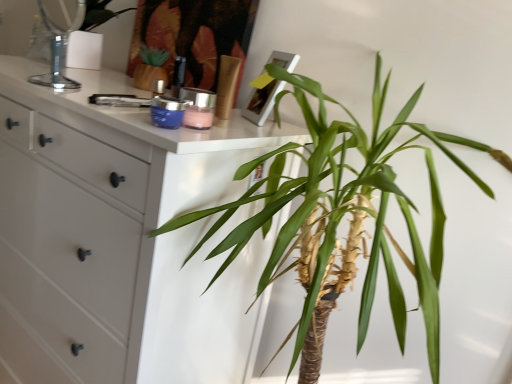
Question: Is green leafy plant at center wider or thinner than clear glass mirror at upper left?

Choices:
 (A) wide
 (B) thin

Answer: (A)

Question: In terms of height, does green leafy plant at center look taller or shorter compared to clear glass mirror at upper left?

Choices:
 (A) tall
 (B) short

Answer: (A)

Question: Which of these objects is positioned farthest from the clear glass mirror at upper left?

Choices:
 (A) green leafy plant at center
 (B) white matte chest of drawers at left
 (C) shiny gold lotion at center

Answer: (A)

Question: Which of these objects is positioned closest to the white matte chest of drawers at left?

Choices:
 (A) shiny gold lotion at center
 (B) green leafy plant at center
 (C) clear glass mirror at upper left

Answer: (B)